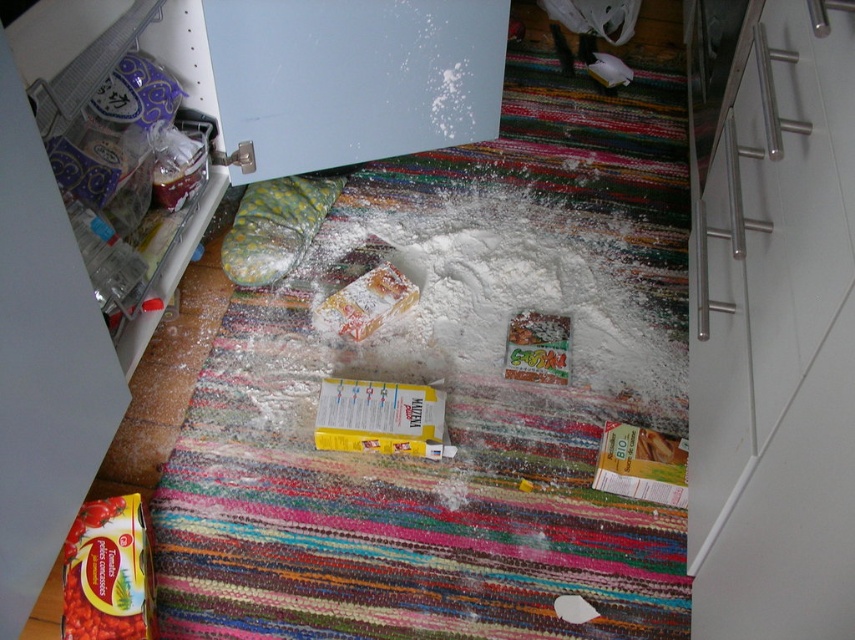
Question: Which of the following is the closest to the observer?

Choices:
 (A) white matte refrigerator at upper center
 (B) matte yellow tomato paste at lower left

Answer: (A)

Question: Can you confirm if white matte refrigerator at upper center is positioned to the right of matte yellow tomato paste at lower left?

Choices:
 (A) yes
 (B) no

Answer: (A)

Question: Among these points, which one is farthest from the camera?

Choices:
 (A) (121, 625)
 (B) (198, 1)

Answer: (B)

Question: Is white matte refrigerator at upper center smaller than matte yellow tomato paste at lower left?

Choices:
 (A) no
 (B) yes

Answer: (A)

Question: Does white matte refrigerator at upper center have a smaller size compared to matte yellow tomato paste at lower left?

Choices:
 (A) yes
 (B) no

Answer: (B)